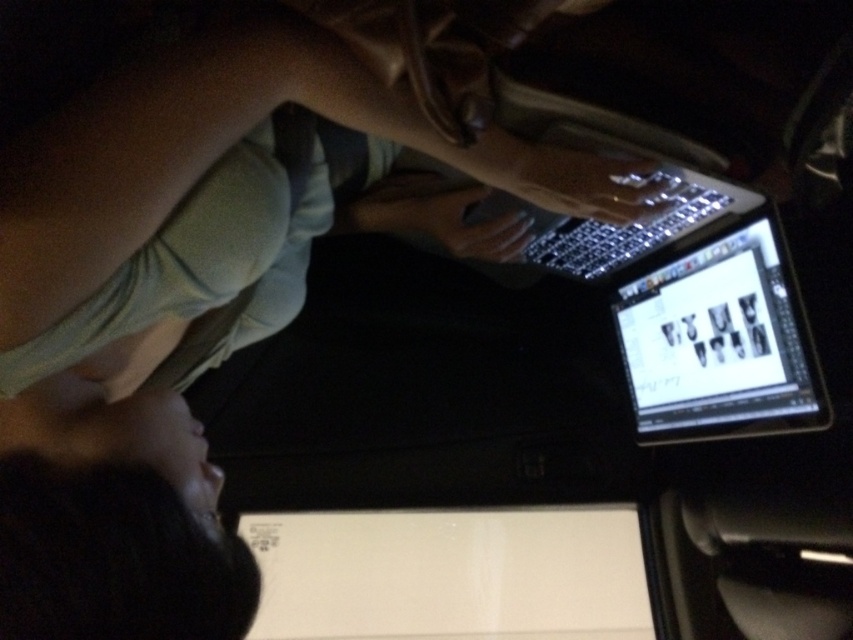
Question: Can you confirm if black matte hair at lower left is thinner than sleek silver laptop at center?

Choices:
 (A) yes
 (B) no

Answer: (A)

Question: Can you confirm if black matte hair at lower left is smaller than sleek silver laptop at center?

Choices:
 (A) no
 (B) yes

Answer: (B)

Question: Which point is closer to the camera taking this photo?

Choices:
 (A) (190, 634)
 (B) (720, 403)

Answer: (A)

Question: Which point is farther from the camera taking this photo?

Choices:
 (A) tap(471, 205)
 (B) tap(692, 344)

Answer: (B)

Question: Which point is farther to the camera?

Choices:
 (A) shiny black tablet at center
 (B) black matte hair at lower left

Answer: (A)

Question: Is black matte hair at lower left bigger than sleek silver laptop at center?

Choices:
 (A) no
 (B) yes

Answer: (A)